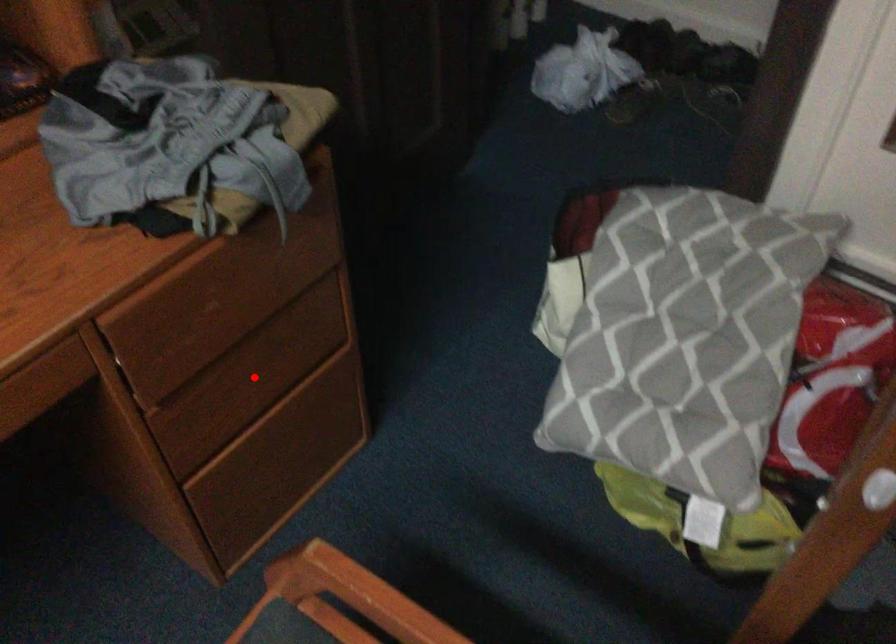
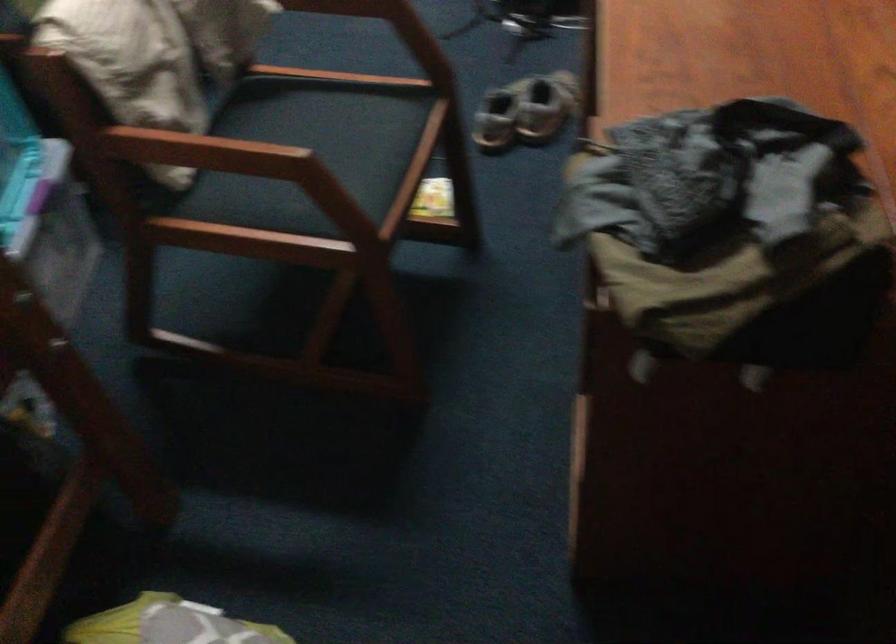
Question: I am providing you with two images of the same scene from different viewpoints. A red point is marked on the first image. Is the red point's position out of view in image 2?

Choices:
 (A) Yes
 (B) No

Answer: (A)